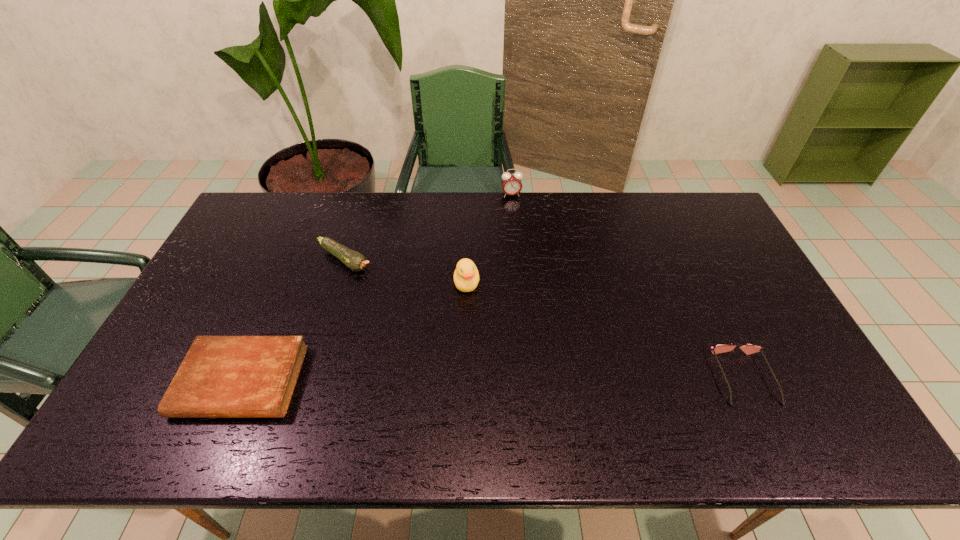
What are the coordinates of `free spot between the zucchini and the sunglasses` in the screenshot? It's located at (544, 319).

This screenshot has height=540, width=960. In order to click on free space between the sunglasses and the zucchini in this screenshot , I will do `click(544, 319)`.

Image resolution: width=960 pixels, height=540 pixels. Identify the location of free space between the duckling and the Bible. (354, 332).

Identify the location of vacant area between the farthest object and the Bible. Image resolution: width=960 pixels, height=540 pixels. (376, 288).

Where is `vacant space in between the rightmost object and the fourth object from left to right`? Image resolution: width=960 pixels, height=540 pixels. vacant space in between the rightmost object and the fourth object from left to right is located at coordinates (628, 286).

Find the location of a particular element. vacant area between the third tallest object and the alarm clock is located at coordinates (428, 228).

Locate an element on the screen. This screenshot has width=960, height=540. blank region between the rightmost object and the Bible is located at coordinates (492, 380).

At what (x,y) coordinates should I click in order to perform the action: click on object that is the second nearest to the Bible. Please return your answer as a coordinate pair (x, y). Image resolution: width=960 pixels, height=540 pixels. Looking at the image, I should click on click(466, 276).

Choose which object is the third nearest neighbor to the alarm clock. Please provide its 2D coordinates. Your answer should be formatted as a tuple, i.e. [(x, y)], where the tuple contains the x and y coordinates of a point satisfying the conditions above.

[(749, 348)]

Locate an element on the screen. vacant area that satisfies the following two spatial constraints: 1. on the back side of the third object from right to left; 2. on the left side of the alarm clock is located at coordinates (469, 195).